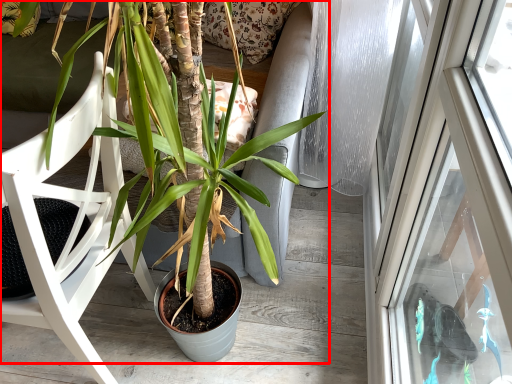
Question: From the image's perspective, where is houseplant (annotated by the red box) located relative to chair?

Choices:
 (A) below
 (B) above

Answer: (B)